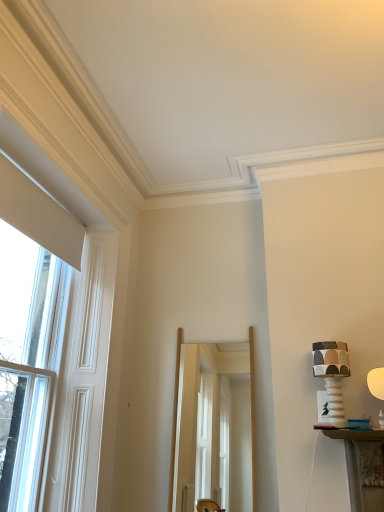
Question: From the image's perspective, is clear glass window at left above or below matte ceramic lampshade at right, positioned as the first table lamp in right-to-left order?

Choices:
 (A) below
 (B) above

Answer: (B)

Question: Is point (11, 265) closer or farther from the camera than point (382, 390)?

Choices:
 (A) farther
 (B) closer

Answer: (A)

Question: Estimate the real-world distances between objects in this image. Which object is closer to the clear glass window at left?

Choices:
 (A) matte ceramic lampshade at right, positioned as the first table lamp in right-to-left order
 (B) clear glass screen door at center
 (C) patterned fabric lampshade at right, which appears as the 2th table lamp when viewed from the right

Answer: (B)

Question: Which object is the closest to the patterned fabric lampshade at right, which appears as the 2th table lamp when viewed from the right?

Choices:
 (A) clear glass screen door at center
 (B) clear glass window at left
 (C) matte ceramic lampshade at right, which ranks as the second table lamp in left-to-right order

Answer: (C)